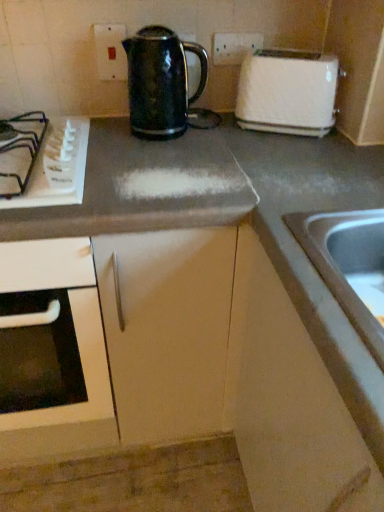
The height and width of the screenshot is (512, 384). Find the location of `vacant space positioned to the left of shiny black kettle at center`. vacant space positioned to the left of shiny black kettle at center is located at coordinates 107,133.